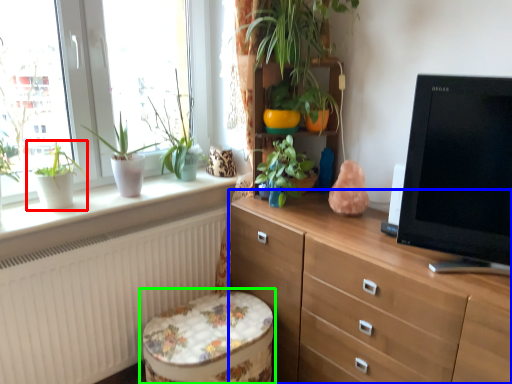
Question: Estimate the real-world distances between objects in this image. Which object is farther from houseplant (highlighted by a red box), chest of drawers (highlighted by a blue box) or music stool (highlighted by a green box)?

Choices:
 (A) chest of drawers
 (B) music stool

Answer: (A)